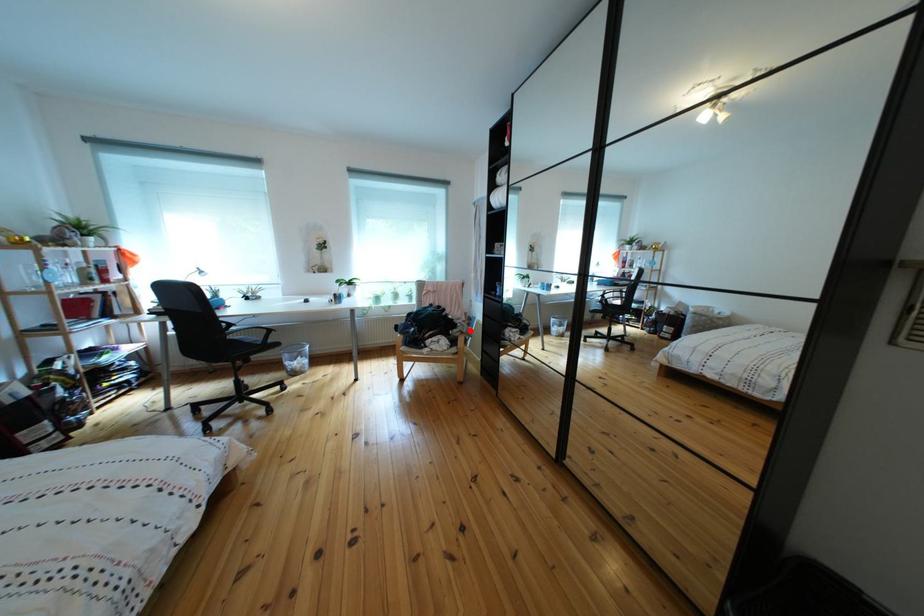
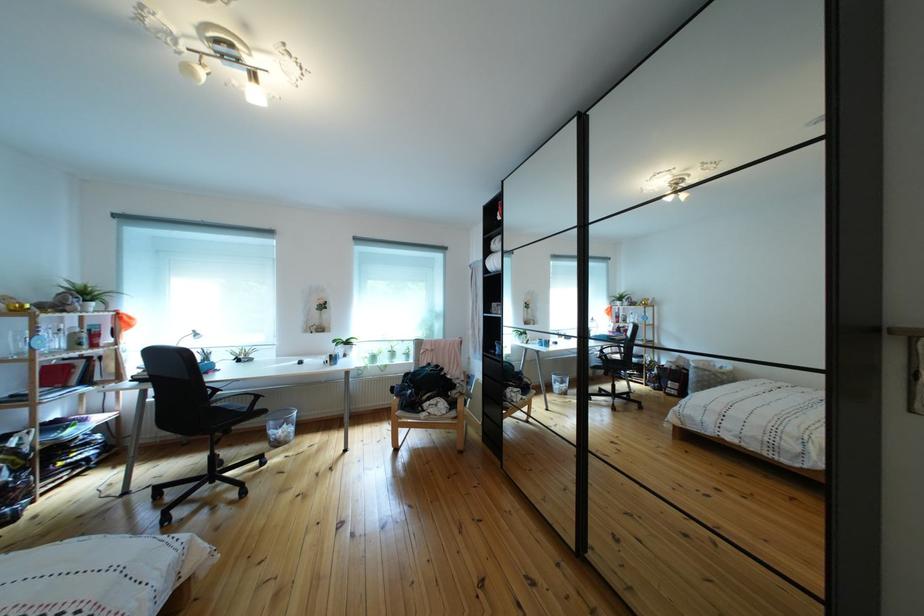
Find the pixel in the second image that matches the highlighted location in the first image.

(469, 391)